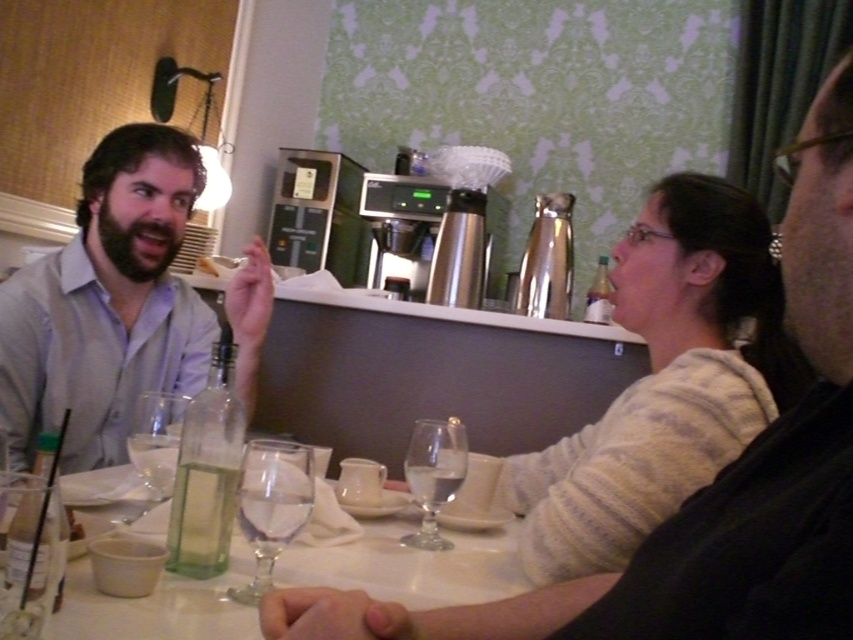
Between light gray sweater at center and clear glass wine glass at table center, which one appears on the right side from the viewer's perspective?

Positioned to the right is light gray sweater at center.

Can you confirm if light gray sweater at center is thinner than clear glass wine glass at table center?

No.

Who is more distant from viewer, (645, 272) or (186, 396)?

The point (186, 396) is more distant.

Locate an element on the screen. This screenshot has height=640, width=853. light gray sweater at center is located at coordinates (666, 381).

Who is positioned more to the right, clear glass wine at center or clear glass wine glass at center?

Positioned to the right is clear glass wine at center.

Which is behind, point (490, 634) or point (405, 540)?

The point (405, 540) is behind.

Between point (798, 196) and point (422, 468), which one is positioned behind?

Positioned behind is point (422, 468).

Locate an element on the screen. The image size is (853, 640). clear glass wine at center is located at coordinates (706, 484).

Does light gray sweater at center appear over transparent glass wine glass at lower center?

Yes, light gray sweater at center is above transparent glass wine glass at lower center.

Who is more distant from viewer, [584,513] or [283,461]?

Positioned behind is point [584,513].

I want to click on light gray sweater at center, so click(x=666, y=381).